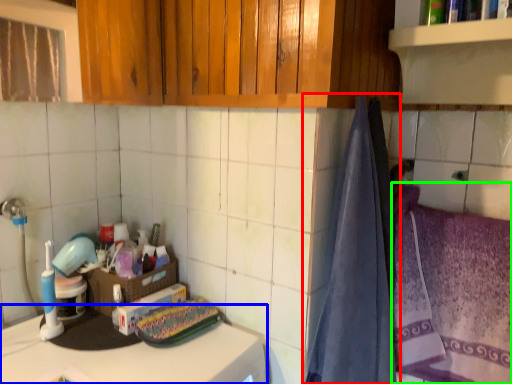
Question: Considering the real-world distances, which object is farthest from curtain (highlighted by a red box)? counter top (highlighted by a blue box) or beach towel (highlighted by a green box)?

Choices:
 (A) counter top
 (B) beach towel

Answer: (A)